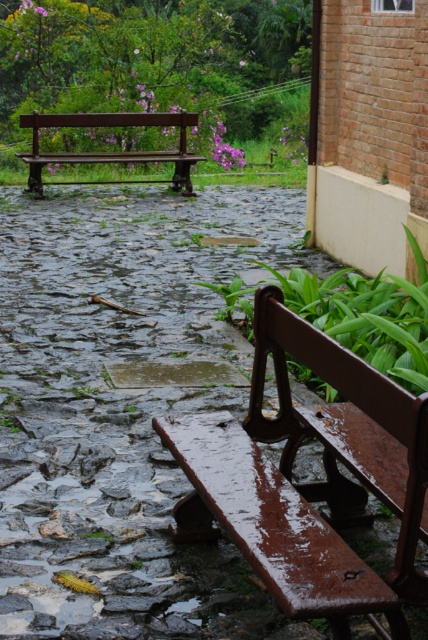
Is point (365, 573) positioned after point (80, 115)?

That is False.

Locate an element on the screen. rusty wood bench at lower center is located at coordinates (305, 483).

Which is more to the left, wet stone path at center or rusty wood bench at lower center?

From the viewer's perspective, wet stone path at center appears more on the left side.

Is the position of wet stone path at center less distant than that of rusty wood bench at lower center?

No, it is behind rusty wood bench at lower center.

Is point (71, 280) positioned before point (416, 426)?

No, it is behind (416, 426).

You are a GUI agent. You are given a task and a screenshot of the screen. Output one action in this format:
    pyautogui.click(x=<x>, y=<y>)
    Task: Click on the wet stone path at center
    
    Given the screenshot: What is the action you would take?
    pyautogui.click(x=121, y=412)

Is point (202, 289) more distant than point (189, 156)?

No, (202, 289) is in front of (189, 156).

Which is in front, point (80, 570) or point (193, 156)?

Point (80, 570) is more forward.

Is point (220, 362) less distant than point (36, 125)?

Yes, it is in front of point (36, 125).

You are a GUI agent. You are given a task and a screenshot of the screen. Output one action in this format:
    pyautogui.click(x=<x>, y=<y>)
    Task: Click on the wet stone path at center
    Image resolution: width=428 pixels, height=640 pixels.
    Given the screenshot: What is the action you would take?
    pyautogui.click(x=121, y=412)